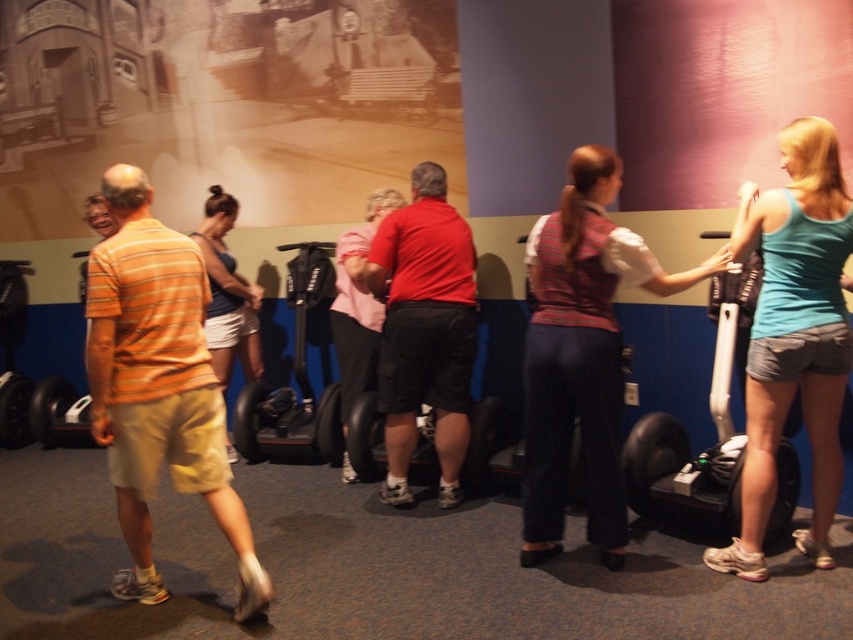
Question: Can you confirm if white matte scooter at right is smaller than matte red shirt at center?

Choices:
 (A) no
 (B) yes

Answer: (A)

Question: Which point is farther from the camera taking this photo?

Choices:
 (A) (793, 477)
 (B) (354, 280)
 (C) (216, 296)
 (D) (804, 224)

Answer: (C)

Question: Estimate the real-world distances between objects in this image. Which object is farther from the orange striped shirt at left?

Choices:
 (A) matte red shirt at center
 (B) white matte scooter at right
 (C) teal fabric tank top at right
 (D) plaid shirt at center

Answer: (C)

Question: Is plaid shirt at center below white matte scooter at right?

Choices:
 (A) yes
 (B) no

Answer: (B)

Question: Estimate the real-world distances between objects in this image. Which object is closer to the orange striped shirt at left?

Choices:
 (A) red matte shirt at center
 (B) plaid shirt at center
 (C) matte blue tank top at center

Answer: (A)

Question: Is orange striped shirt at left below white matte scooter at right?

Choices:
 (A) yes
 (B) no

Answer: (A)